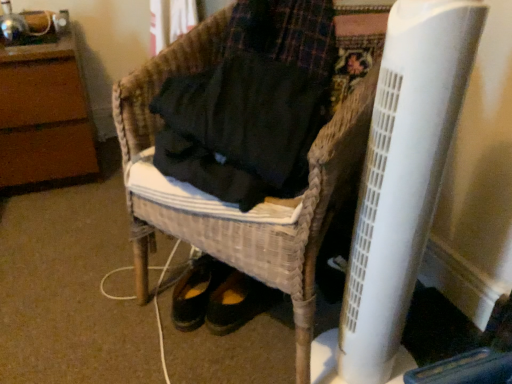
Question: Is white plastic radiator at lower right placed right next to woven wicker chair at center, which appears as the 1th furniture when viewed from the right?

Choices:
 (A) no
 (B) yes

Answer: (A)

Question: Is the position of white plastic radiator at lower right more distant than that of woven wicker chair at center, arranged as the 2th furniture when viewed from the left?

Choices:
 (A) no
 (B) yes

Answer: (A)

Question: Considering the relative sizes of white plastic radiator at lower right and woven wicker chair at center, arranged as the 2th furniture when viewed from the left, in the image provided, is white plastic radiator at lower right taller than woven wicker chair at center, arranged as the 2th furniture when viewed from the left,?

Choices:
 (A) yes
 (B) no

Answer: (A)

Question: Is white plastic radiator at lower right turned away from woven wicker chair at center, which ranks as the first furniture in front-to-back order?

Choices:
 (A) no
 (B) yes

Answer: (A)

Question: Is woven wicker chair at center, which ranks as the first furniture in front-to-back order, surrounded by white plastic radiator at lower right?

Choices:
 (A) yes
 (B) no

Answer: (B)

Question: Does white plastic radiator at lower right appear on the left side of woven wicker chair at center, which ranks as the first furniture in front-to-back order?

Choices:
 (A) yes
 (B) no

Answer: (B)

Question: From the image's perspective, does brown wood dresser at upper left, positioned as the second furniture in front-to-back order, appear higher than white plastic radiator at lower right?

Choices:
 (A) no
 (B) yes

Answer: (B)

Question: From the image's perspective, is brown wood dresser at upper left, positioned as the second furniture in front-to-back order, below white plastic radiator at lower right?

Choices:
 (A) no
 (B) yes

Answer: (A)

Question: Is brown wood dresser at upper left, the first furniture in the left-to-right sequence, smaller than white plastic radiator at lower right?

Choices:
 (A) no
 (B) yes

Answer: (A)

Question: Considering the relative sizes of brown wood dresser at upper left, the first furniture in the left-to-right sequence, and white plastic radiator at lower right in the image provided, is brown wood dresser at upper left, the first furniture in the left-to-right sequence, taller than white plastic radiator at lower right?

Choices:
 (A) yes
 (B) no

Answer: (B)

Question: Is brown wood dresser at upper left, positioned as the first furniture in back-to-front order, in front of white plastic radiator at lower right?

Choices:
 (A) yes
 (B) no

Answer: (B)

Question: Considering the relative sizes of brown wood dresser at upper left, positioned as the second furniture in front-to-back order, and white plastic radiator at lower right in the image provided, is brown wood dresser at upper left, positioned as the second furniture in front-to-back order, bigger than white plastic radiator at lower right?

Choices:
 (A) no
 (B) yes

Answer: (B)

Question: Does woven wicker chair at center, marked as the 2th furniture in a back-to-front arrangement, have a larger size compared to white plastic radiator at lower right?

Choices:
 (A) no
 (B) yes

Answer: (B)